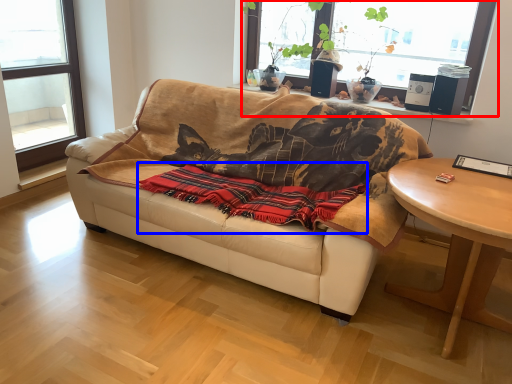
Question: Which object appears closest to the camera in this image, window (highlighted by a red box) or blanket (highlighted by a blue box)?

Choices:
 (A) window
 (B) blanket

Answer: (B)